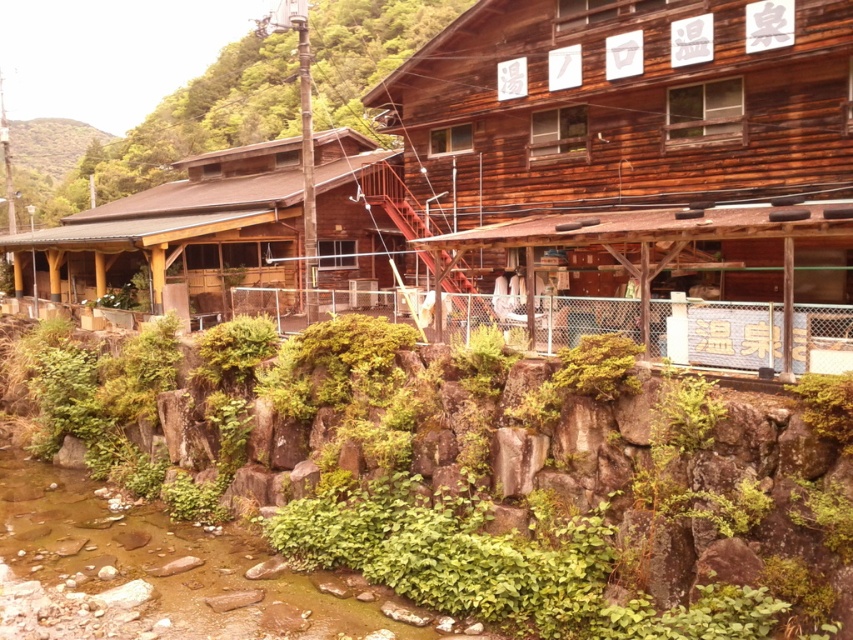
Question: Can you confirm if brown stone creek at lower left is positioned above green leafy hillside at upper left?

Choices:
 (A) yes
 (B) no

Answer: (B)

Question: Which object is the closest to the brown stone creek at lower left?

Choices:
 (A) green leafy hillside at upper left
 (B) brown wooden hut at center
 (C) wooden hut at center

Answer: (C)

Question: Is green mossy rock at lower center closer to the viewer compared to green leafy shrubs at center?

Choices:
 (A) no
 (B) yes

Answer: (B)

Question: Which of the following is the farthest from the observer?

Choices:
 (A) (16, 129)
 (B) (647, 198)
 (C) (212, 72)

Answer: (A)

Question: Which of the following is the closest to the observer?

Choices:
 (A) (218, 170)
 (B) (44, 154)

Answer: (A)

Question: Does brown stone creek at lower left have a greater width compared to green leafy hillside at upper left?

Choices:
 (A) no
 (B) yes

Answer: (A)